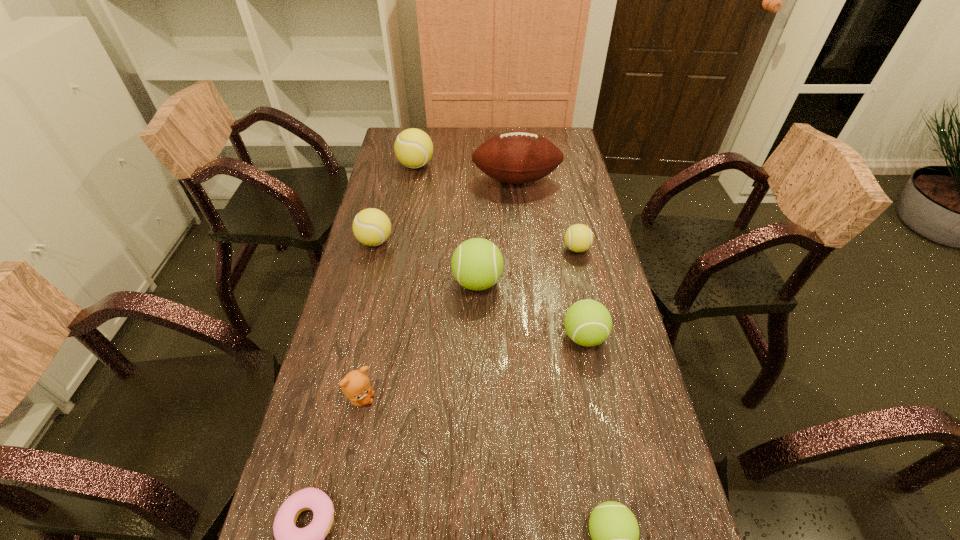
What are the coordinates of `teddy bear located at the left edge` in the screenshot? It's located at coord(355,385).

Locate an element on the screen. This screenshot has width=960, height=540. football (American) located at the right edge is located at coordinates (517, 157).

This screenshot has height=540, width=960. I want to click on object that is at the far left corner, so click(413, 147).

At what (x,y) coordinates should I click in order to perform the action: click on vacant space at the far edge of the desktop. Please return your answer as a coordinate pair (x, y). Looking at the image, I should click on (500, 132).

Locate an element on the screen. This screenshot has height=540, width=960. free point at the left edge is located at coordinates (374, 312).

The image size is (960, 540). In order to click on vacant region at the right edge of the desktop in this screenshot , I will do 582,258.

The width and height of the screenshot is (960, 540). What are the coordinates of `free space at the far right corner of the desktop` in the screenshot? It's located at 555,133.

Identify the location of empty location between the teddy bear and the football (American). (439, 290).

Find the location of a particular element. free space between the football (American) and the fourth tennis ball from right to left is located at coordinates (496, 231).

Locate an element on the screen. This screenshot has height=540, width=960. vacant space that's between the biggest yellow tennis ball and the brown teddy bear is located at coordinates (389, 282).